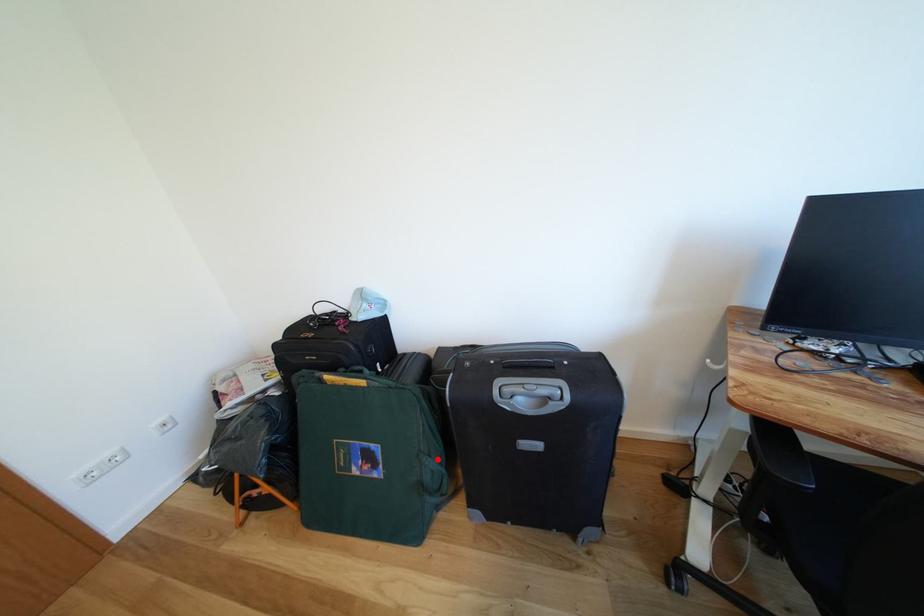
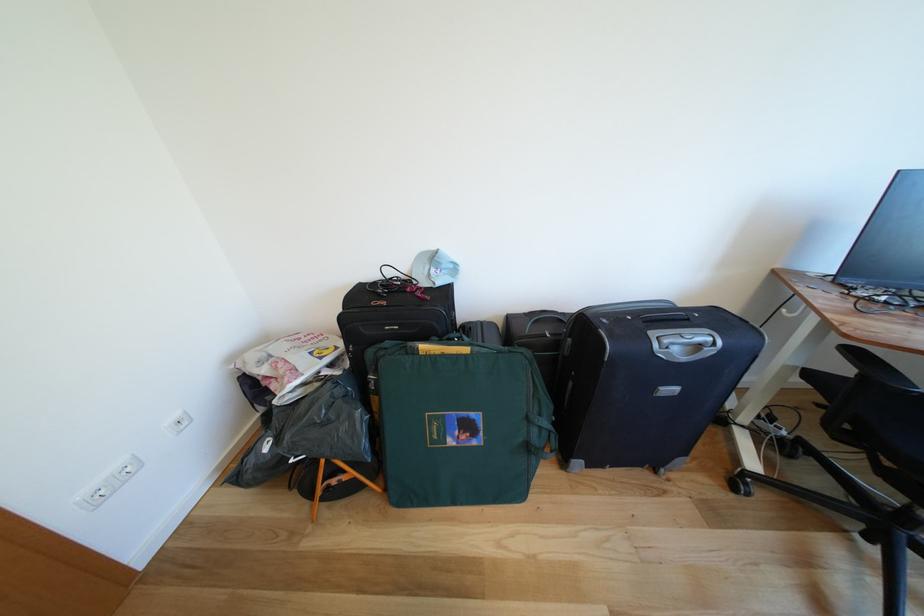
Find the pixel in the second image that matches the highlighted location in the first image.

(548, 419)